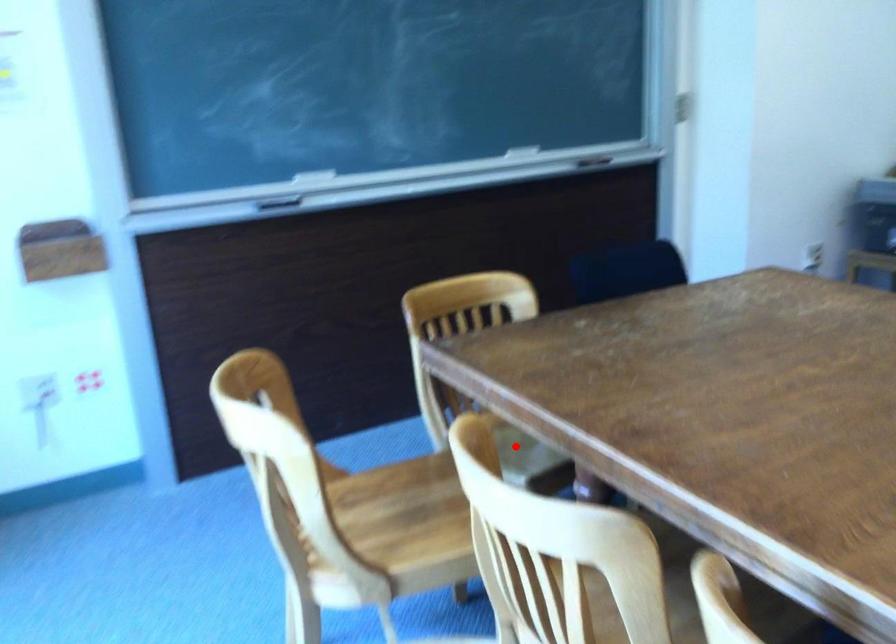
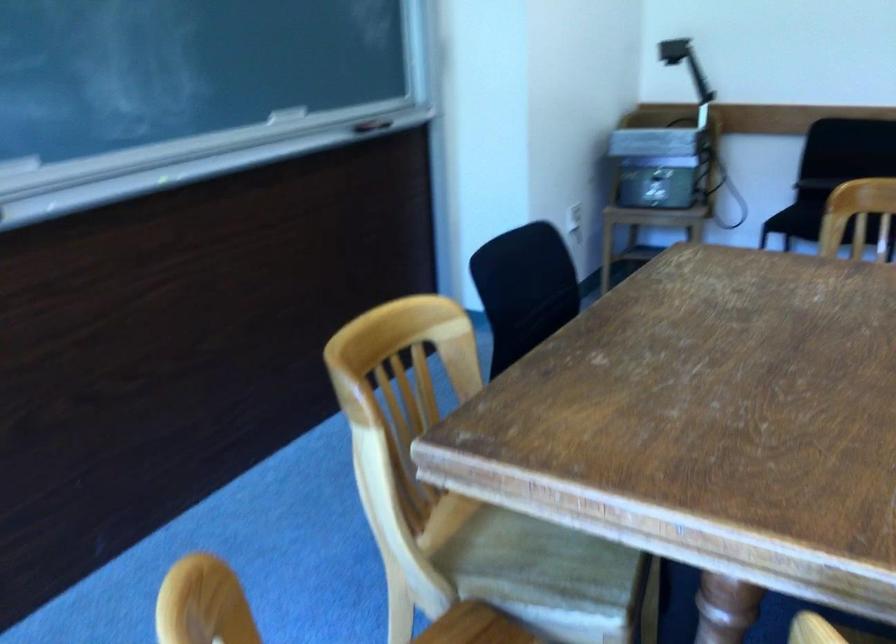
In the second image, find the point that corresponds to the highlighted location in the first image.

(528, 556)